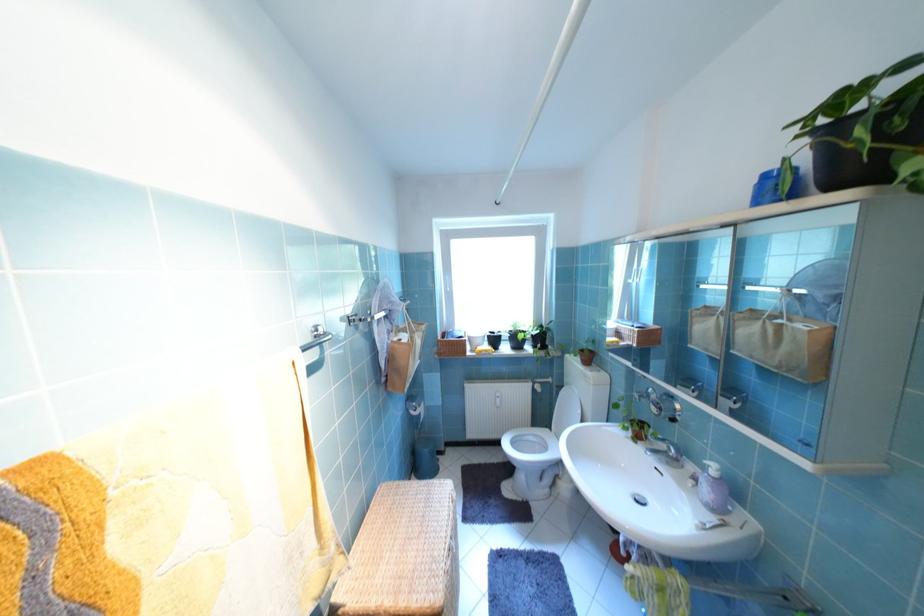
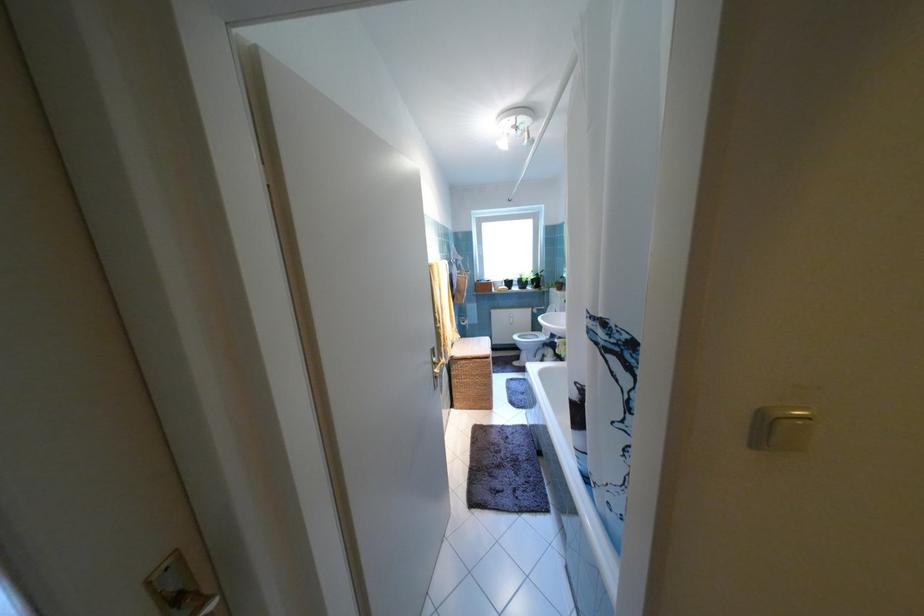
The point at (578, 357) is marked in the first image. Where is the corresponding point in the second image?

(561, 290)